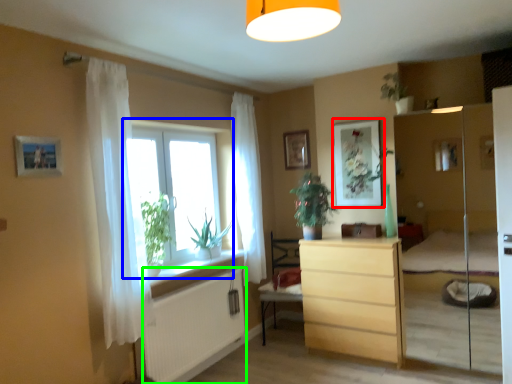
Question: Which is nearer to the picture frame (highlighted by a red box)? window (highlighted by a blue box) or radiator (highlighted by a green box).

Choices:
 (A) window
 (B) radiator

Answer: (A)